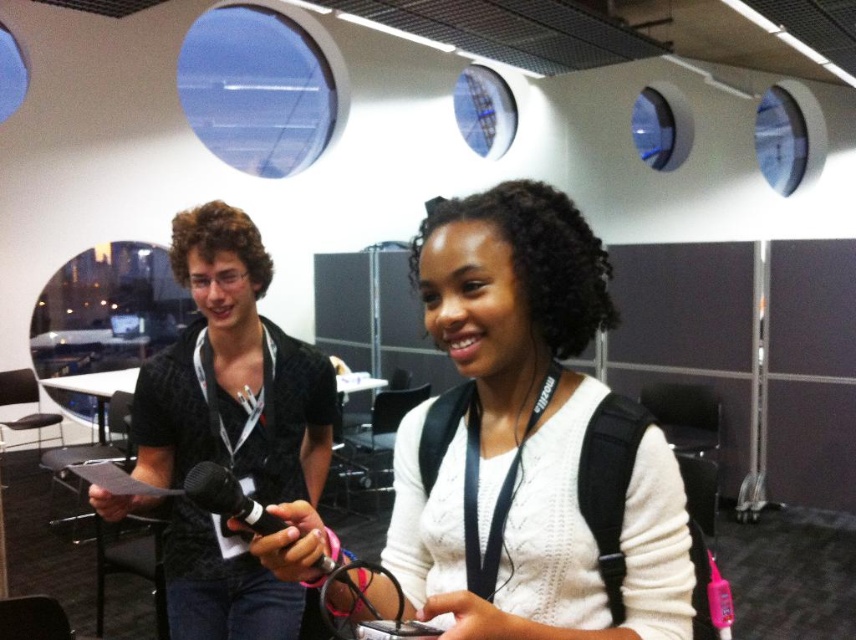
You are organizing a photo shoot and need to ensure that the two main subjects are clearly visible. Given the white knitted sweater at center and the black textured shirt at left, which one might be easier to see from a distance due to its size?

The black textured shirt at left is larger than the white knitted sweater at center, so it would be easier to see from a distance.

You are an event organizer arranging seating for a panel discussion. The panelist wearing the black textured shirt at left needs to be seated to the left of the guest speaker in the white knitted sweater at center. Based on their current positions in the image, is this arrangement already correct?

The white knitted sweater at center is already to the right of the black textured shirt at left, so the current arrangement meets the requirement that the guest speaker should be seated to the right of the panelist in the black textured shirt at left.

You are organizing a photoshoot and need to ensure that the two participants are positioned so that the wider garment is on the left side of the frame. Given the current setup, does the white knitted sweater at center and the black textured shirt at left meet this requirement?

The white knitted sweater at center is wider than the black textured shirt at left. Since the requirement is to have the wider garment on the left, the current setup does not meet the requirement because the wider white knitted sweater at center is positioned to the right of the black textured shirt at left.